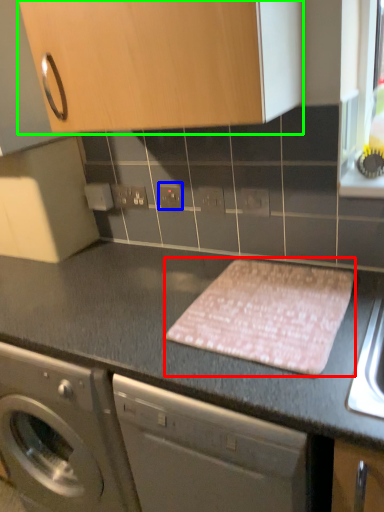
Question: Based on their relative distances, which object is nearer to blanket (highlighted by a red box)? Choose from electric outlet (highlighted by a blue box) and cabinetry (highlighted by a green box).

Choices:
 (A) electric outlet
 (B) cabinetry

Answer: (B)